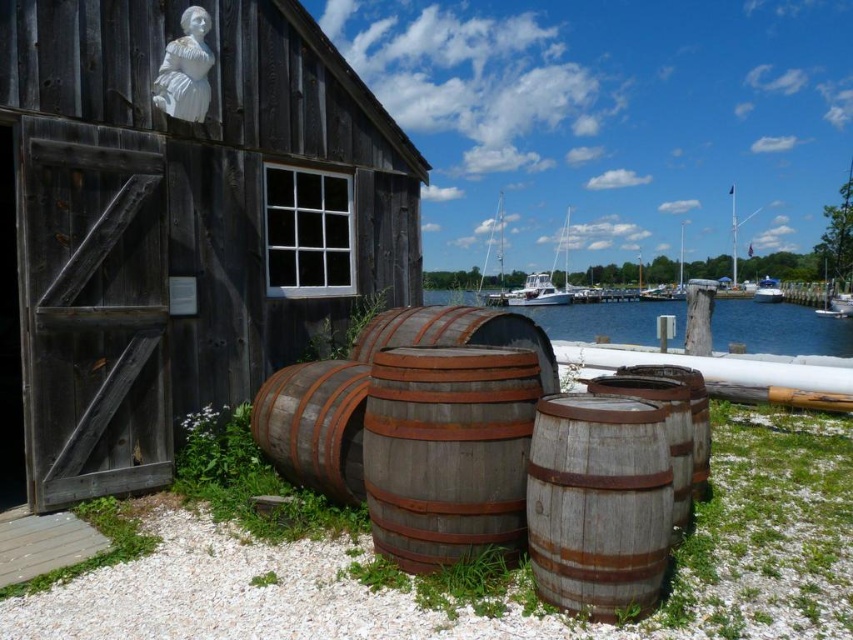
Is rusty wood barrels at center positioned in front of weathered wood barrel at center?

No.

Is rusty wood barrels at center smaller than weathered wood barrel at center?

No, rusty wood barrels at center is not smaller than weathered wood barrel at center.

Is point (434, 360) farther from viewer compared to point (561, 486)?

Yes, it is.

You are a GUI agent. You are given a task and a screenshot of the screen. Output one action in this format:
    pyautogui.click(x=<x>, y=<y>)
    Task: Click on the rusty wood barrels at center
    Image resolution: width=853 pixels, height=640 pixels.
    Given the screenshot: What is the action you would take?
    pyautogui.click(x=479, y=452)

Which is behind, point (438, 387) or point (740, 301)?

Point (740, 301)

Locate an element on the screen. This screenshot has height=640, width=853. rusty wood barrels at center is located at coordinates (479, 452).

Locate an element on the screen. The height and width of the screenshot is (640, 853). rusty wood barrels at center is located at coordinates (479, 452).

Does wooden barrel at center appear over wooden dock at lower left?

Yes.

Does wooden barrel at center have a larger size compared to wooden dock at lower left?

Indeed, wooden barrel at center has a larger size compared to wooden dock at lower left.

Locate an element on the screen. This screenshot has height=640, width=853. wooden barrel at center is located at coordinates (447, 451).